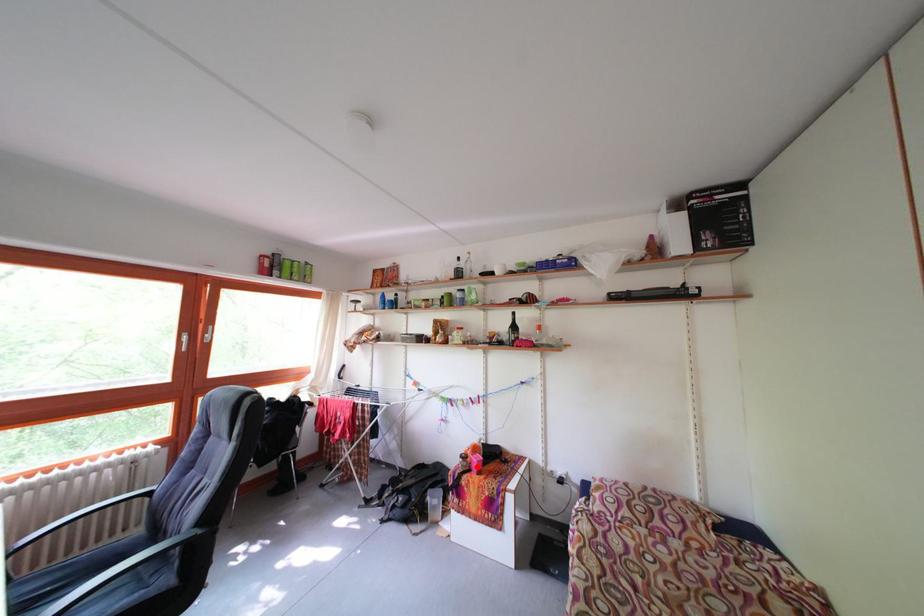
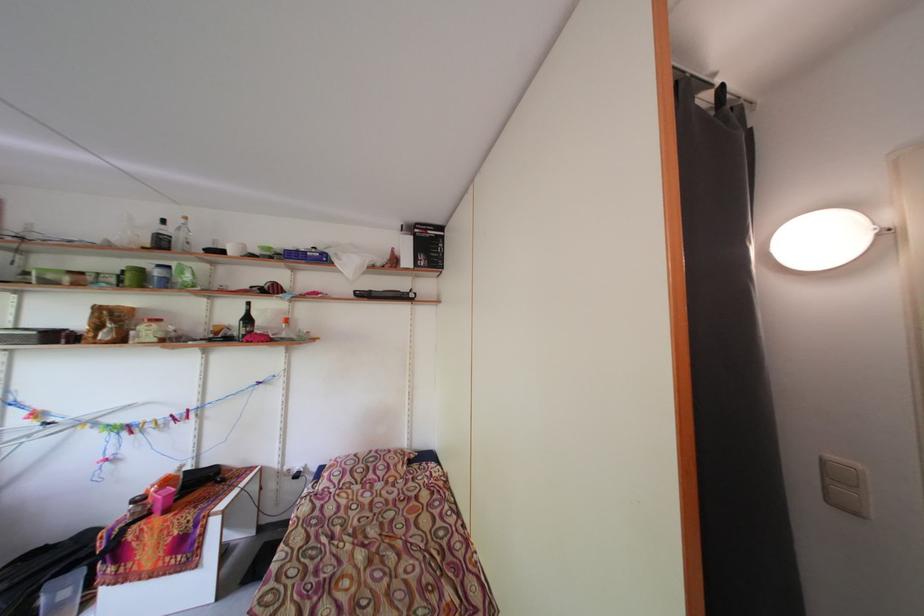
Locate, in the second image, the point that corresponds to the highlighted location in the first image.

(156, 508)